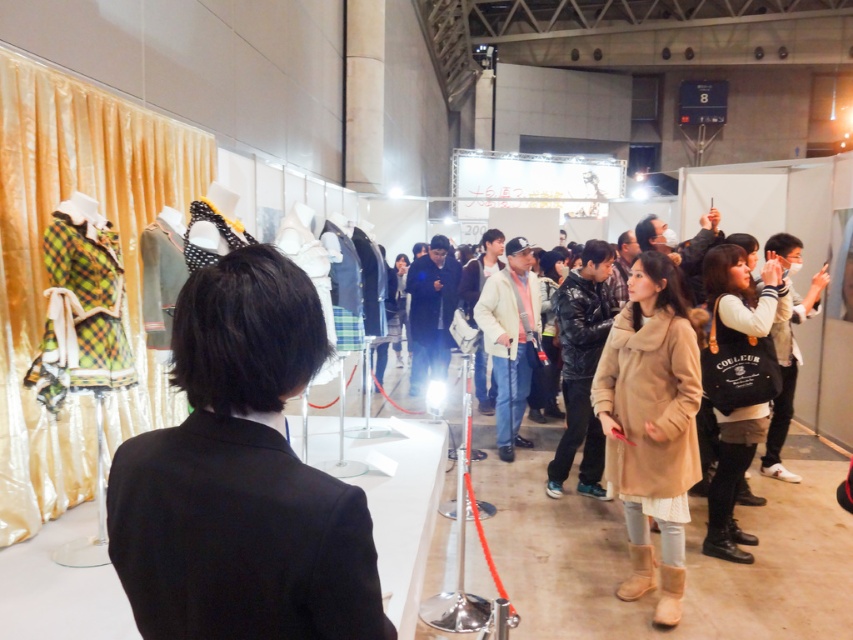
Can you confirm if camel wool coat at center is positioned to the right of white fleece jacket at center right?

In fact, camel wool coat at center is to the left of white fleece jacket at center right.

Based on the photo, can you confirm if camel wool coat at center is thinner than white fleece jacket at center right?

Yes, camel wool coat at center is thinner than white fleece jacket at center right.

I want to click on camel wool coat at center, so click(x=651, y=426).

Looking at this image, does black matte blazer at left have a greater width compared to camel wool coat at center?

No, black matte blazer at left is not wider than camel wool coat at center.

Is black matte blazer at left taller than camel wool coat at center?

In fact, black matte blazer at left may be shorter than camel wool coat at center.

Where is `black matte blazer at left`? The image size is (853, 640). black matte blazer at left is located at coordinates (241, 477).

Does black matte blazer at left have a lesser height compared to white fleece jacket at center right?

Correct, black matte blazer at left is not as tall as white fleece jacket at center right.

Can you confirm if black matte blazer at left is positioned to the right of white fleece jacket at center right?

Incorrect, black matte blazer at left is not on the right side of white fleece jacket at center right.

Is point (227, 524) positioned before point (773, 301)?

Yes.

This screenshot has height=640, width=853. I want to click on black matte blazer at left, so click(241, 477).